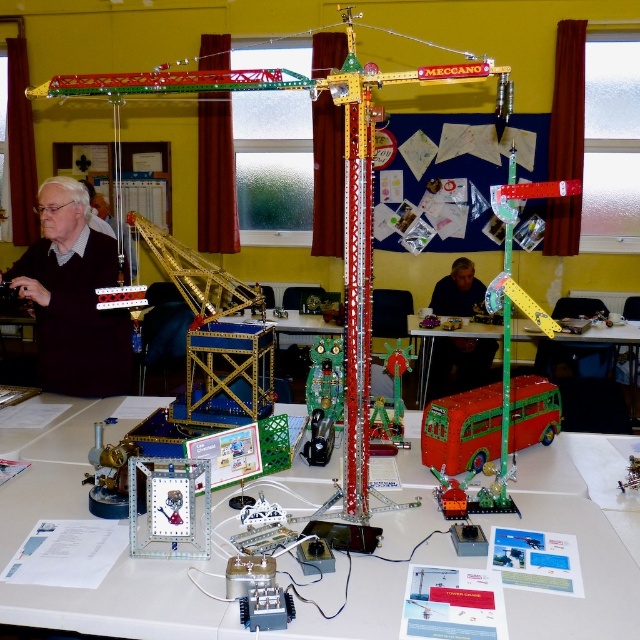
Question: Which of the following is the closest to the observer?

Choices:
 (A) (477, 305)
 (B) (202, 618)

Answer: (B)

Question: In this image, where is shiny red bus at center located relative to dark blue shirt at center?

Choices:
 (A) below
 (B) above

Answer: (A)

Question: Which of the following is the farthest from the observer?

Choices:
 (A) metallic red crane at center
 (B) shiny red bus at center
 (C) matte black sweater at left

Answer: (C)

Question: Which of the following is the farthest from the observer?

Choices:
 (A) metallic silver clock at center
 (B) shiny red bus at center

Answer: (B)

Question: Can you confirm if metallic red crane at center is bigger than shiny red bus at center?

Choices:
 (A) yes
 (B) no

Answer: (A)

Question: Can you confirm if metallic red crane at center is thinner than dark blue shirt at center?

Choices:
 (A) no
 (B) yes

Answer: (A)